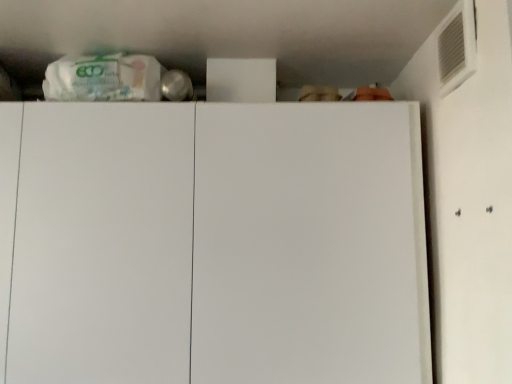
Where is `white matte cabinet at center`? The width and height of the screenshot is (512, 384). white matte cabinet at center is located at coordinates (212, 243).

In order to face white matte cabinet at center, should I rotate leftwards or rightwards?

Rotate left and turn 9.870 degrees.

The height and width of the screenshot is (384, 512). What do you see at coordinates (212, 243) in the screenshot?
I see `white matte cabinet at center` at bounding box center [212, 243].

This screenshot has height=384, width=512. What do you see at coordinates (457, 46) in the screenshot?
I see `white plastic air conditioning at upper right` at bounding box center [457, 46].

The width and height of the screenshot is (512, 384). Find the location of `white plastic air conditioning at upper right`. white plastic air conditioning at upper right is located at coordinates (457, 46).

Locate an element on the screen. white matte cabinet at center is located at coordinates (212, 243).

Considering the relative positions of white matte cabinet at center and white plastic air conditioning at upper right in the image provided, is white matte cabinet at center to the left of white plastic air conditioning at upper right from the viewer's perspective?

Indeed, white matte cabinet at center is positioned on the left side of white plastic air conditioning at upper right.

Is white matte cabinet at center closer to camera compared to white plastic air conditioning at upper right?

No, white matte cabinet at center is further to the viewer.

Does point (323, 218) lie behind point (471, 41)?

That is True.

From the image's perspective, which is below, white matte cabinet at center or white plastic air conditioning at upper right?

white matte cabinet at center.

Looking at this image, from a real-world perspective, is white matte cabinet at center above or below white plastic air conditioning at upper right?

Clearly, from a real-world perspective, white matte cabinet at center is below white plastic air conditioning at upper right.

Considering the sizes of objects white matte cabinet at center and white plastic air conditioning at upper right in the image provided, who is wider, white matte cabinet at center or white plastic air conditioning at upper right?

With larger width is white matte cabinet at center.

Which of these two, white matte cabinet at center or white plastic air conditioning at upper right, stands taller?

With more height is white matte cabinet at center.

Is white matte cabinet at center bigger than white plastic air conditioning at upper right?

Yes.

Is white plastic air conditioning at upper right a part of white matte cabinet at center?

No, white matte cabinet at center does not contain white plastic air conditioning at upper right.

Is white matte cabinet at center not near white plastic air conditioning at upper right?

No, there isn't a large distance between white matte cabinet at center and white plastic air conditioning at upper right.

Is white plastic air conditioning at upper right at the back of white matte cabinet at center?

No, white matte cabinet at center is not facing the opposite direction of white plastic air conditioning at upper right.

How far apart are white matte cabinet at center and white plastic air conditioning at upper right?

white matte cabinet at center and white plastic air conditioning at upper right are 22.66 inches apart from each other.

What are the coordinates of `air conditioning in front of the white matte cabinet at center` in the screenshot? It's located at (457, 46).

Looking at this image, which object is positioned more to the right, white plastic air conditioning at upper right or white matte cabinet at center?

white plastic air conditioning at upper right.

Which object is further away from the camera taking this photo, white plastic air conditioning at upper right or white matte cabinet at center?

white matte cabinet at center is more distant.

Is point (466, 30) closer or farther from the camera than point (103, 354)?

Point (466, 30) is positioned closer to the camera compared to point (103, 354).

From the image's perspective, is white plastic air conditioning at upper right located above white matte cabinet at center?

Yes, from the image's perspective, white plastic air conditioning at upper right is over white matte cabinet at center.

From a real-world perspective, which is physically above, white plastic air conditioning at upper right or white matte cabinet at center?

white plastic air conditioning at upper right.

In terms of width, does white plastic air conditioning at upper right look wider or thinner when compared to white matte cabinet at center?

Considering their sizes, white plastic air conditioning at upper right looks slimmer than white matte cabinet at center.

Consider the image. Between white plastic air conditioning at upper right and white matte cabinet at center, which one has more height?

Standing taller between the two is white matte cabinet at center.

From the picture: Which of these two, white plastic air conditioning at upper right or white matte cabinet at center, is bigger?

With larger size is white matte cabinet at center.

Based on the photo, is white matte cabinet at center surrounded by white plastic air conditioning at upper right?

No, white matte cabinet at center is located outside of white plastic air conditioning at upper right.

Are white plastic air conditioning at upper right and white matte cabinet at center far apart?

They are positioned close to each other.

Is white plastic air conditioning at upper right aimed at white matte cabinet at center?

No, white plastic air conditioning at upper right is not oriented towards white matte cabinet at center.

What's the angular difference between white plastic air conditioning at upper right and white matte cabinet at center's facing directions?

The angle between the facing direction of white plastic air conditioning at upper right and the facing direction of white matte cabinet at center is 91.7 degrees.

Measure the distance from white plastic air conditioning at upper right to white matte cabinet at center.

57.56 centimeters.

The width and height of the screenshot is (512, 384). I want to click on air conditioning in front of the white matte cabinet at center, so click(457, 46).

This screenshot has height=384, width=512. What are the coordinates of `cabinetry behind the white plastic air conditioning at upper right` in the screenshot? It's located at (212, 243).

The height and width of the screenshot is (384, 512). In order to click on cabinetry on the left of white plastic air conditioning at upper right in this screenshot , I will do `click(212, 243)`.